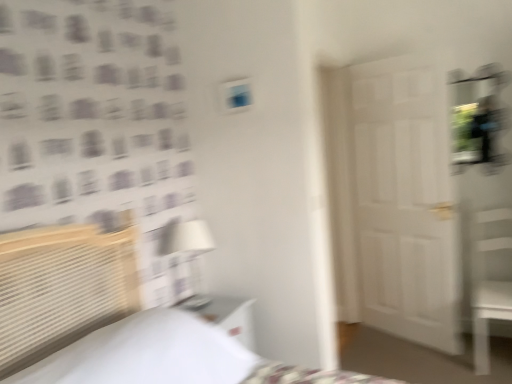
This screenshot has height=384, width=512. In order to click on vacant point above white glossy nightstand at lower center (from a real-world perspective) in this screenshot , I will do `click(201, 306)`.